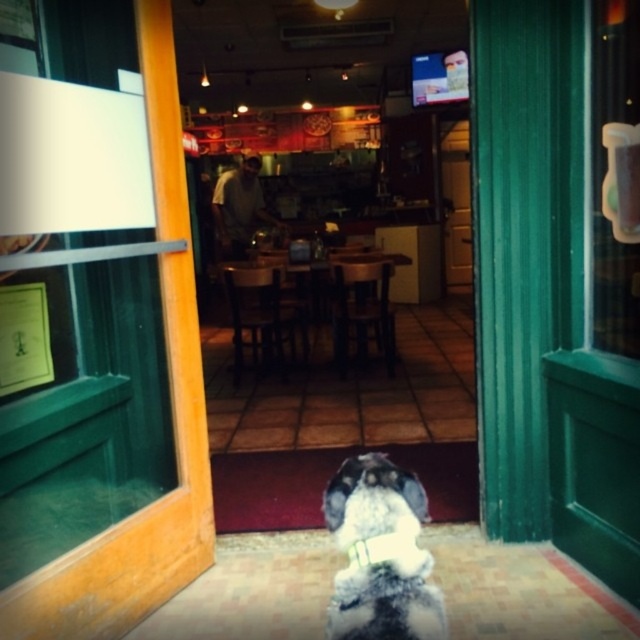
Is white fluffy dog at center further to camera compared to green wooden door at center?

That is False.

Between point (422, 611) and point (449, 273), which one is positioned behind?

Point (449, 273)

Who is more forward, (429,589) or (470,273)?

Point (429,589) is more forward.

This screenshot has width=640, height=640. In order to click on white fluffy dog at center in this screenshot , I will do `click(380, 554)`.

Is green wooden door at center taller than white fabric neckband at center?

Indeed, green wooden door at center has a greater height compared to white fabric neckband at center.

Which is in front, point (454, 218) or point (404, 557)?

Point (404, 557)

At what (x,y) coordinates should I click in order to perform the action: click on green wooden door at center. Please return your answer as a coordinate pair (x, y). This screenshot has height=640, width=640. Looking at the image, I should click on (456, 204).

Who is positioned more to the right, transparent plastic cup at upper right or white fabric neckband at center?

Positioned to the right is transparent plastic cup at upper right.

Is transparent plastic cup at upper right to the right of white fabric neckband at center from the viewer's perspective?

Yes, transparent plastic cup at upper right is to the right of white fabric neckband at center.

Who is more forward, (609, 179) or (396, 550)?

Point (396, 550)

Locate an element on the screen. Image resolution: width=640 pixels, height=640 pixels. transparent plastic cup at upper right is located at coordinates (604, 323).